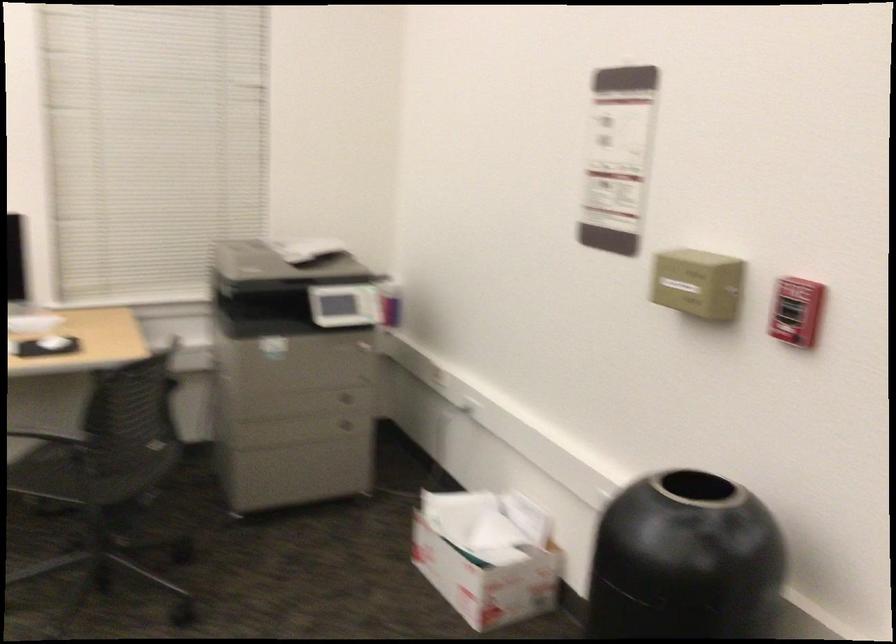
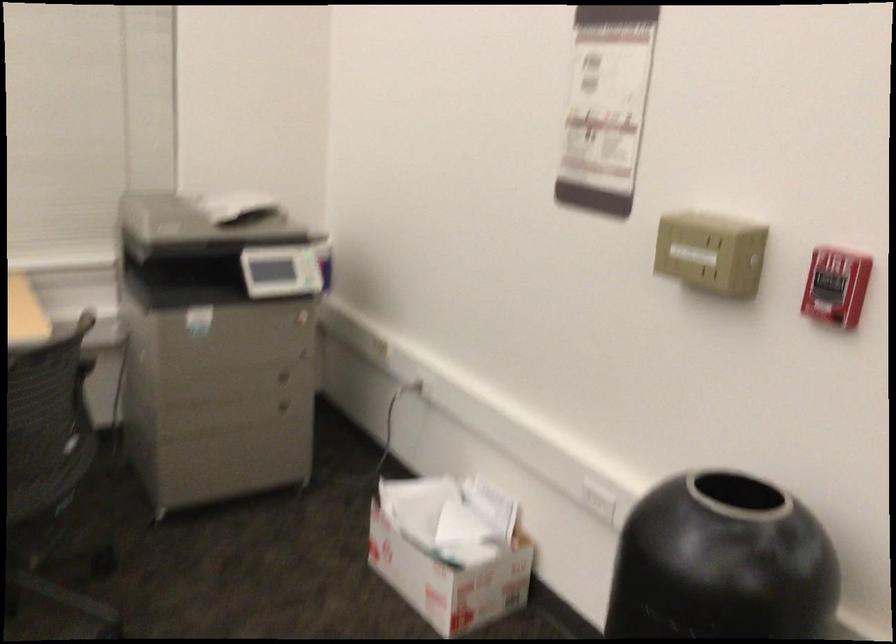
From the picture: The images are taken continuously from a first-person perspective. In which direction are you moving?

The cameraman moved toward left, forward.